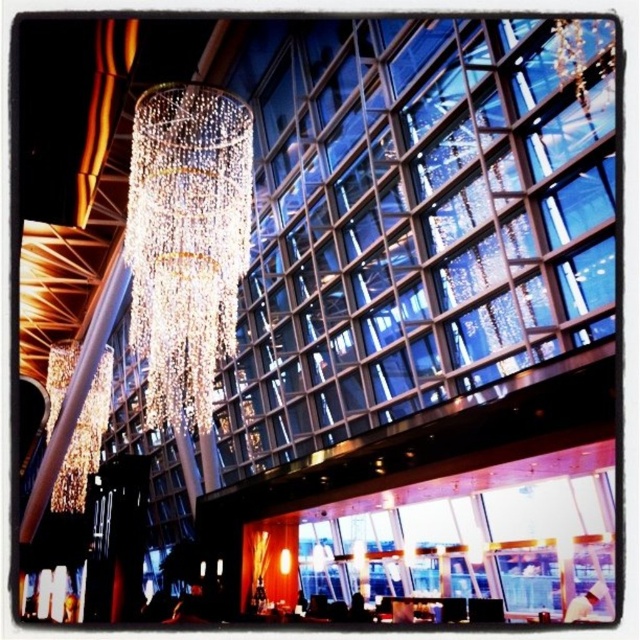
Question: Which of the following is the closest to the observer?

Choices:
 (A) tap(161, 204)
 (B) tap(96, 456)

Answer: (A)

Question: Which of the following is the farthest from the observer?

Choices:
 (A) iridescent glass chandelier at upper center
 (B) clear crystal chandelier at center

Answer: (A)

Question: Is clear crystal chandelier at center smaller than iridescent glass chandelier at upper center?

Choices:
 (A) no
 (B) yes

Answer: (A)

Question: Does clear crystal chandelier at center appear on the right side of iridescent glass chandelier at upper center?

Choices:
 (A) yes
 (B) no

Answer: (A)

Question: Which point is farther from the camera taking this photo?

Choices:
 (A) (193, 413)
 (B) (68, 358)

Answer: (B)

Question: In this image, where is clear crystal chandelier at center located relative to iridescent glass chandelier at upper center?

Choices:
 (A) left
 (B) right

Answer: (B)